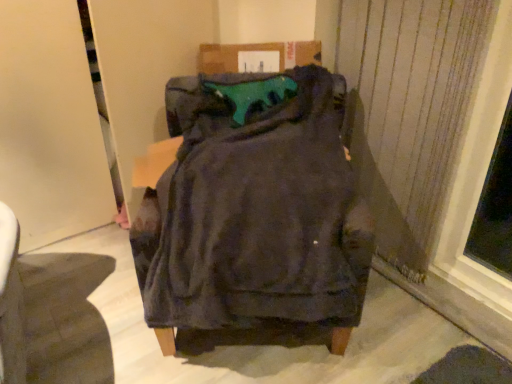
Image resolution: width=512 pixels, height=384 pixels. Identify the location of teal fabric cushion at center. (255, 93).

The image size is (512, 384). Describe the element at coordinates (255, 93) in the screenshot. I see `teal fabric cushion at center` at that location.

Find the location of a particular element. This screenshot has width=512, height=384. satin fabric curtain at right is located at coordinates pyautogui.click(x=409, y=110).

Where is `dark fabric chair at center`? The height and width of the screenshot is (384, 512). dark fabric chair at center is located at coordinates (254, 210).

Looking at this image, which is closer, (x=426, y=30) or (x=245, y=93)?

Point (x=426, y=30) is closer to the camera than point (x=245, y=93).

Which of these two, satin fabric curtain at right or teal fabric cushion at center, stands taller?

satin fabric curtain at right.

Who is smaller, satin fabric curtain at right or teal fabric cushion at center?

With smaller size is teal fabric cushion at center.

Is satin fabric curtain at right oriented away from teal fabric cushion at center?

satin fabric curtain at right does not have its back to teal fabric cushion at center.

Considering the sizes of objects dark fabric chair at center and satin fabric curtain at right in the image provided, who is taller, dark fabric chair at center or satin fabric curtain at right?

satin fabric curtain at right is taller.

Considering the relative positions of dark fabric chair at center and satin fabric curtain at right in the image provided, is dark fabric chair at center to the left of satin fabric curtain at right from the viewer's perspective?

Indeed, dark fabric chair at center is positioned on the left side of satin fabric curtain at right.

Which point is more distant from viewer, (263, 293) or (384, 35)?

The point (384, 35) is farther from the camera.

Is the surface of dark fabric chair at center in direct contact with satin fabric curtain at right?

No, dark fabric chair at center is not beside satin fabric curtain at right.

Does teal fabric cushion at center come behind dark fabric chair at center?

Yes, teal fabric cushion at center is behind dark fabric chair at center.

Does point (240, 108) lie in front of point (325, 187)?

No, it is not.

Which object is thinner, teal fabric cushion at center or dark fabric chair at center?

teal fabric cushion at center is thinner.

From the image's perspective, which object appears higher, dark fabric chair at center or teal fabric cushion at center?

teal fabric cushion at center, from the image's perspective.

Looking at this image, is dark fabric chair at center not near teal fabric cushion at center?

They are positioned close to each other.

Does dark fabric chair at center come in front of teal fabric cushion at center?

Yes, dark fabric chair at center is closer to the camera.

From a real-world perspective, relative to teal fabric cushion at center, is dark fabric chair at center vertically above or below?

Clearly, from a real-world perspective, dark fabric chair at center is below teal fabric cushion at center.

Is satin fabric curtain at right wider or thinner than dark fabric chair at center?

satin fabric curtain at right is thinner than dark fabric chair at center.

Can you confirm if satin fabric curtain at right is bigger than dark fabric chair at center?

No.

Is satin fabric curtain at right far from dark fabric chair at center?

No, satin fabric curtain at right is not far away from dark fabric chair at center.

Which is closer, (456, 29) or (349, 258)?

Point (456, 29) is positioned farther from the camera compared to point (349, 258).

Between teal fabric cushion at center and satin fabric curtain at right, which one is positioned in front?

satin fabric curtain at right is closer to the camera.

The image size is (512, 384). Find the location of `curtain on the right of teal fabric cushion at center`. curtain on the right of teal fabric cushion at center is located at coordinates (409, 110).

How far apart are teal fabric cushion at center and satin fabric curtain at right?

The distance of teal fabric cushion at center from satin fabric curtain at right is 20.09 inches.

From the picture: Considering the relative sizes of teal fabric cushion at center and satin fabric curtain at right in the image provided, is teal fabric cushion at center smaller than satin fabric curtain at right?

Yes.

At what (x,y) coordinates should I click in order to perform the action: click on teal lying on the left of satin fabric curtain at right. Please return your answer as a coordinate pair (x, y). This screenshot has width=512, height=384. Looking at the image, I should click on (255, 93).

Identify the location of curtain located behind the dark fabric chair at center. The height and width of the screenshot is (384, 512). (409, 110).

Looking at the image, which one is located closer to satin fabric curtain at right, dark fabric chair at center or teal fabric cushion at center?

Based on the image, teal fabric cushion at center appears to be nearer to satin fabric curtain at right.

Looking at the image, which one is located further to dark fabric chair at center, teal fabric cushion at center or satin fabric curtain at right?

satin fabric curtain at right is further to dark fabric chair at center.

Based on their spatial positions, is dark fabric chair at center or satin fabric curtain at right closer to teal fabric cushion at center?

Based on the image, dark fabric chair at center appears to be nearer to teal fabric cushion at center.

Estimate the real-world distances between objects in this image. Which object is further from satin fabric curtain at right, teal fabric cushion at center or dark fabric chair at center?

Based on the image, dark fabric chair at center appears to be further to satin fabric curtain at right.

From the image, which object appears to be nearer to dark fabric chair at center, satin fabric curtain at right or teal fabric cushion at center?

teal fabric cushion at center is positioned closer to the anchor dark fabric chair at center.

Estimate the real-world distances between objects in this image. Which object is further from teal fabric cushion at center, satin fabric curtain at right or dark fabric chair at center?

satin fabric curtain at right is further to teal fabric cushion at center.

Identify the location of teal between dark fabric chair at center and satin fabric curtain at right from left to right. This screenshot has height=384, width=512. (255, 93).